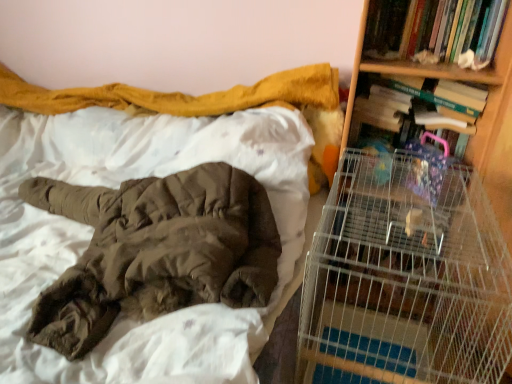
Question: Is metal wire cage at right in front of or behind wooden bookshelf at right in the image?

Choices:
 (A) front
 (B) behind

Answer: (A)

Question: In terms of width, does metal wire cage at right look wider or thinner when compared to wooden bookshelf at right?

Choices:
 (A) thin
 (B) wide

Answer: (B)

Question: Estimate the real-world distances between objects in this image. Which object is closer to the brown fuzzy blanket at upper left?

Choices:
 (A) metal wire cage at right
 (B) wooden bookshelf at right
 (C) hardcover book at upper right, the 2th book from the top
 (D) hardcover book at upper right, which is the second book in bottom-to-top order

Answer: (A)

Question: Which of these objects is positioned farthest from the hardcover book at upper right, which is the first book in top-to-bottom order?

Choices:
 (A) metal wire cage at right
 (B) wooden bookshelf at right
 (C) brown fuzzy blanket at upper left
 (D) hardcover book at upper right, the 2th book from the top

Answer: (C)